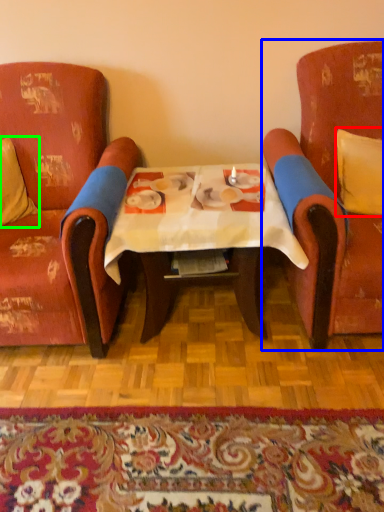
Question: Based on their relative distances, which object is nearer to pillow (highlighted by a red box)? Choose from chair (highlighted by a blue box) and pillow (highlighted by a green box).

Choices:
 (A) chair
 (B) pillow

Answer: (A)